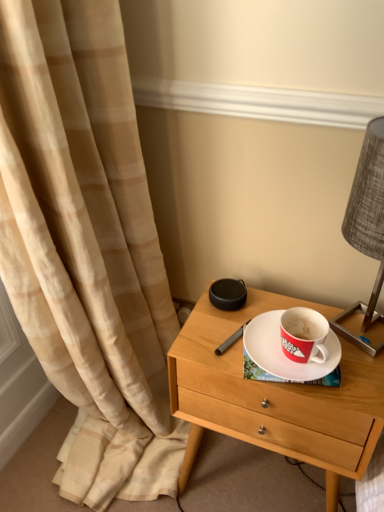
Question: From a real-world perspective, is white matte saucer at center positioned above or below light wood/finish nightstand at center?

Choices:
 (A) above
 (B) below

Answer: (A)

Question: From the image's perspective, is white matte saucer at center positioned above or below light wood/finish nightstand at center?

Choices:
 (A) above
 (B) below

Answer: (A)

Question: Estimate the real-world distances between objects in this image. Which object is farther from the textured gray lampshade at right?

Choices:
 (A) light wood/finish nightstand at center
 (B) white matte saucer at center

Answer: (A)

Question: Which is nearer to the textured gray lampshade at right?

Choices:
 (A) light wood/finish nightstand at center
 (B) white matte saucer at center

Answer: (B)